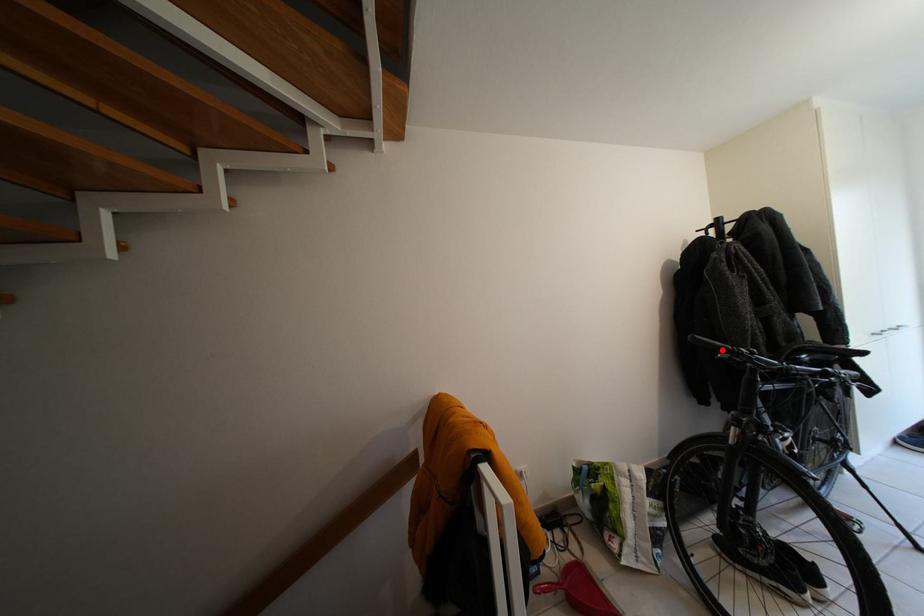
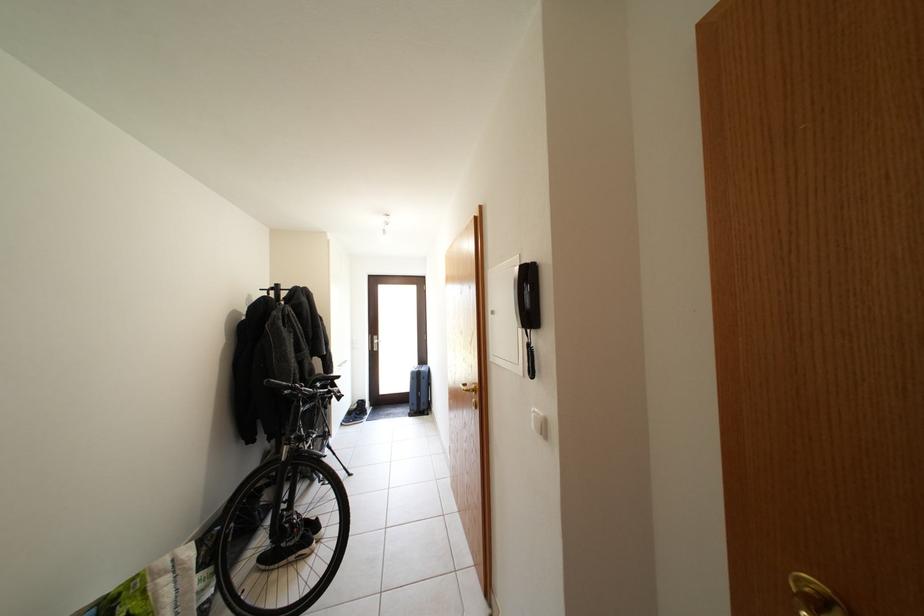
The point at the highlighted location is marked in the first image. Where is the corresponding point in the second image?

(289, 390)